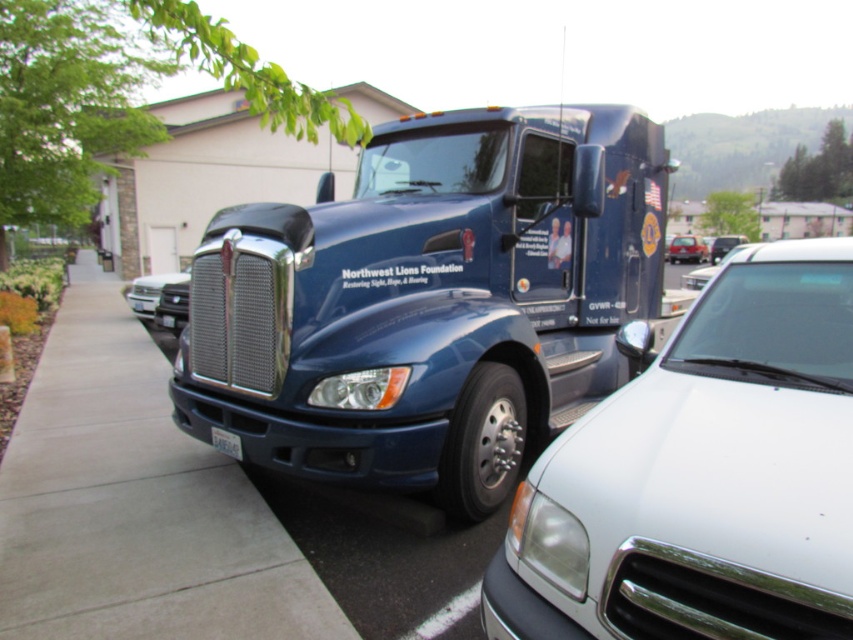
Can you confirm if glossy blue trailer truck at center is positioned to the right of concrete at center?

Indeed, glossy blue trailer truck at center is positioned on the right side of concrete at center.

Which of these two, glossy blue trailer truck at center or concrete at center, stands shorter?

glossy blue trailer truck at center

Which is behind, point (537, 134) or point (120, 508)?

Point (537, 134)

What are the coordinates of `glossy blue trailer truck at center` in the screenshot? It's located at (430, 300).

Does concrete at center have a lesser width compared to matte black truck at center?

Indeed, concrete at center has a lesser width compared to matte black truck at center.

Where is `concrete at center`? concrete at center is located at coordinates (135, 502).

Does concrete at center have a lesser width compared to white plastic license plate at lower center?

No, concrete at center is not thinner than white plastic license plate at lower center.

Can you confirm if concrete at center is positioned to the right of white plastic license plate at lower center?

In fact, concrete at center is to the left of white plastic license plate at lower center.

The height and width of the screenshot is (640, 853). Describe the element at coordinates (135, 502) in the screenshot. I see `concrete at center` at that location.

The width and height of the screenshot is (853, 640). Identify the location of concrete at center. (135, 502).